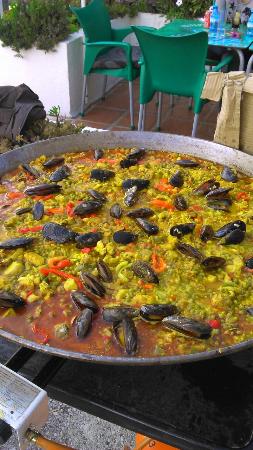
I want to click on green chair, so click(183, 67).